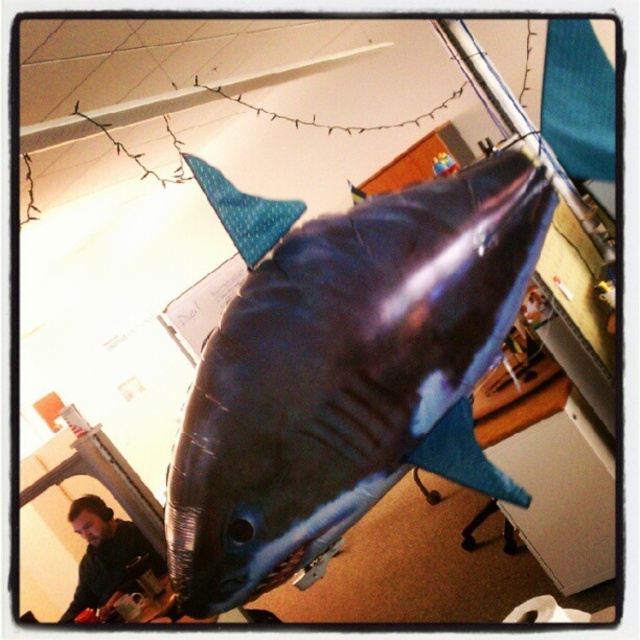
You are an office worker who needs to hang a new poster on the wall behind the shiny metallic shark at center and the blue dotted fabric fin at upper center. Considering their sizes, which object will require you to use a higher ladder to reach its top?

The shiny metallic shark at center has a greater height compared to the blue dotted fabric fin at upper center, so you will need a higher ladder to reach the top of the shiny metallic shark at center.

You are standing in an office and want to place a new potted plant on the desk. The shiny metallic shark at center is currently blocking the area where you want to place it. Based on its position, can you estimate whether the shark is positioned closer to the front or back edge of the desk?

The shiny metallic shark at center is located at point (346, 372), which means it is closer to the back edge of the desk. Therefore, you can place the potted plant near the front edge without obstruction.